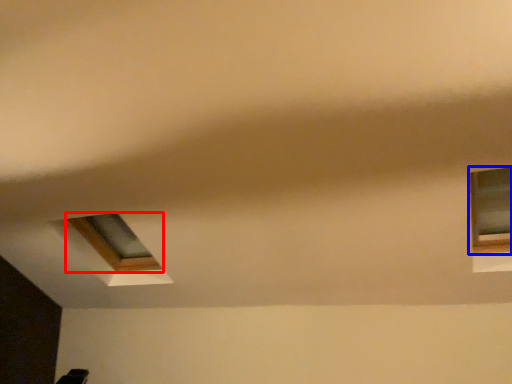
Question: Which object appears closest to the camera in this image, window (highlighted by a red box) or window (highlighted by a blue box)?

Choices:
 (A) window
 (B) window

Answer: (B)